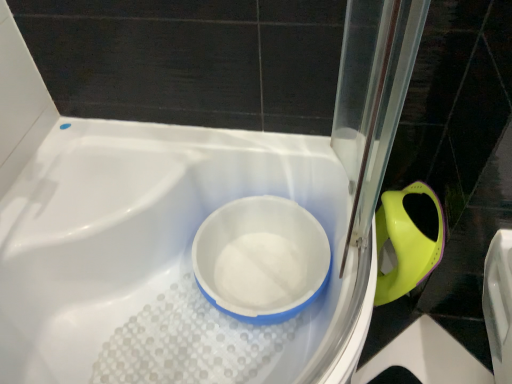
Measure the distance between point [316,221] and camera.

Point [316,221] and camera are 3.85 feet apart.

This screenshot has height=384, width=512. Identify the location of white plastic bowl at center. (261, 259).

In order to face white plastic bath at center, should I rotate leftwards or rightwards?

A 8.310 degree turn to the left will do.

Identify the location of matte green plastic bidet at right. This screenshot has height=384, width=512. (406, 244).

What is the approximate width of matte green plastic bidet at right?

11.64 inches.

This screenshot has width=512, height=384. Identify the location of white plastic bowl at center. (261, 259).

Is white plastic bowl at center at the back of matte green plastic bidet at right?

That's not correct — matte green plastic bidet at right is not looking away from white plastic bowl at center.

Are matte green plastic bidet at right and white plastic bowl at center making contact?

They are not placed beside each other.

How far apart are matte green plastic bidet at right and white plastic bowl at center?

matte green plastic bidet at right is 11.39 inches away from white plastic bowl at center.

Considering the relative sizes of matte green plastic bidet at right and white plastic bowl at center in the image provided, is matte green plastic bidet at right shorter than white plastic bowl at center?

No, matte green plastic bidet at right is not shorter than white plastic bowl at center.

Is white plastic bath at center outside of matte green plastic bidet at right?

Absolutely, white plastic bath at center is external to matte green plastic bidet at right.

From a real-world perspective, is white plastic bath at center on matte green plastic bidet at right?

Yes, from a real-world perspective, white plastic bath at center is on top of matte green plastic bidet at right.

Who is bigger, white plastic bath at center or matte green plastic bidet at right?

white plastic bath at center.

Can you see white plastic bath at center touching matte green plastic bidet at right?

No, white plastic bath at center is not next to matte green plastic bidet at right.

This screenshot has height=384, width=512. Identify the location of bath to the left of white plastic bowl at center. (158, 240).

Is white plastic bowl at center not near white plastic bath at center?

No, white plastic bowl at center is not far from white plastic bath at center.

From the image's perspective, relative to white plastic bath at center, is white plastic bowl at center above or below?

Answer: From the image's perspective, white plastic bowl at center appears above white plastic bath at center.

Considering the sizes of objects white plastic bath at center and white plastic bowl at center in the image provided, who is shorter, white plastic bath at center or white plastic bowl at center?

white plastic bowl at center is shorter.

Locate an element on the screen. bath that appears on the left of white plastic bowl at center is located at coordinates (158, 240).

Could you tell me if white plastic bath at center is turned towards white plastic bowl at center?

Yes, white plastic bath at center is facing white plastic bowl at center.

Considering the positions of objects white plastic bath at center and white plastic bowl at center in the image provided, who is more to the left, white plastic bath at center or white plastic bowl at center?

Positioned to the left is white plastic bath at center.

Is white plastic bowl at center outside of matte green plastic bidet at right?

white plastic bowl at center lies outside matte green plastic bidet at right's area.

Considering the relative sizes of white plastic bowl at center and matte green plastic bidet at right in the image provided, is white plastic bowl at center taller than matte green plastic bidet at right?

No, white plastic bowl at center is not taller than matte green plastic bidet at right.

Is the position of white plastic bowl at center more distant than that of matte green plastic bidet at right?

No, white plastic bowl at center is in front of matte green plastic bidet at right.

Could you tell me if white plastic bowl at center is facing matte green plastic bidet at right?

No.

Considering the sizes of objects matte green plastic bidet at right and white plastic bath at center in the image provided, who is bigger, matte green plastic bidet at right or white plastic bath at center?

Bigger between the two is white plastic bath at center.

Which of these two, matte green plastic bidet at right or white plastic bath at center, stands taller?

Standing taller between the two is white plastic bath at center.

From the image's perspective, is matte green plastic bidet at right beneath white plastic bath at center?

No.

Which is in front, matte green plastic bidet at right or white plastic bath at center?

Positioned in front is white plastic bath at center.

Locate an element on the screen. This screenshot has width=512, height=384. bidet below the white plastic bowl at center (from a real-world perspective) is located at coordinates (406, 244).

You are a GUI agent. You are given a task and a screenshot of the screen. Output one action in this format:
    pyautogui.click(x=<x>, y=<y>)
    Task: Click on the bidet behind the white plastic bath at center
    Image resolution: width=512 pixels, height=384 pixels.
    Given the screenshot: What is the action you would take?
    pyautogui.click(x=406, y=244)

When comparing their distances from white plastic bowl at center, does matte green plastic bidet at right or white plastic bath at center seem further?

The object further to white plastic bowl at center is matte green plastic bidet at right.

Which object lies further to the anchor point white plastic bath at center, white plastic bowl at center or matte green plastic bidet at right?

matte green plastic bidet at right is positioned further to the anchor white plastic bath at center.

Estimate the real-world distances between objects in this image. Which object is closer to matte green plastic bidet at right, white plastic bath at center or white plastic bowl at center?

white plastic bowl at center is closer to matte green plastic bidet at right.

In the scene shown: Which object lies nearer to the anchor point white plastic bath at center, matte green plastic bidet at right or white plastic bowl at center?

The object closer to white plastic bath at center is white plastic bowl at center.

From the image, which object appears to be farther from white plastic bowl at center, white plastic bath at center or matte green plastic bidet at right?

matte green plastic bidet at right lies further to white plastic bowl at center than the other object.

Looking at the image, which one is located further to matte green plastic bidet at right, white plastic bowl at center or white plastic bath at center?

The object further to matte green plastic bidet at right is white plastic bath at center.

Image resolution: width=512 pixels, height=384 pixels. I want to click on toilet between white plastic bath at center and matte green plastic bidet at right from left to right, so click(261, 259).